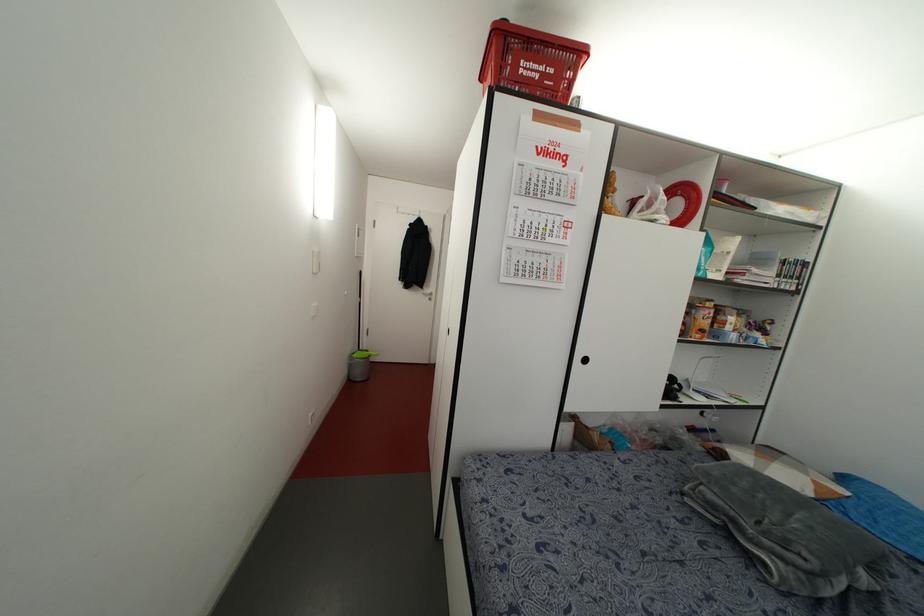
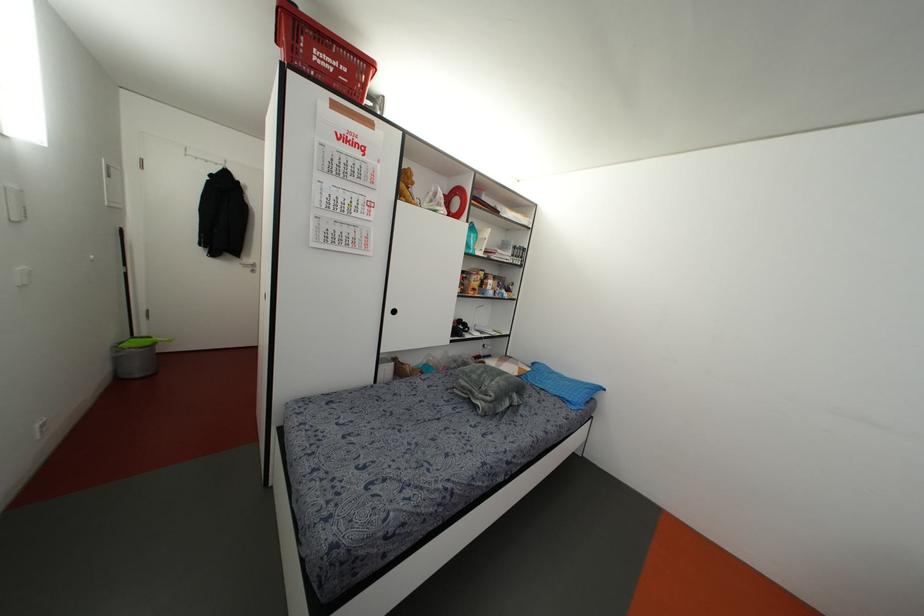
The point at (359, 233) is marked in the first image. Where is the corresponding point in the second image?

(112, 172)